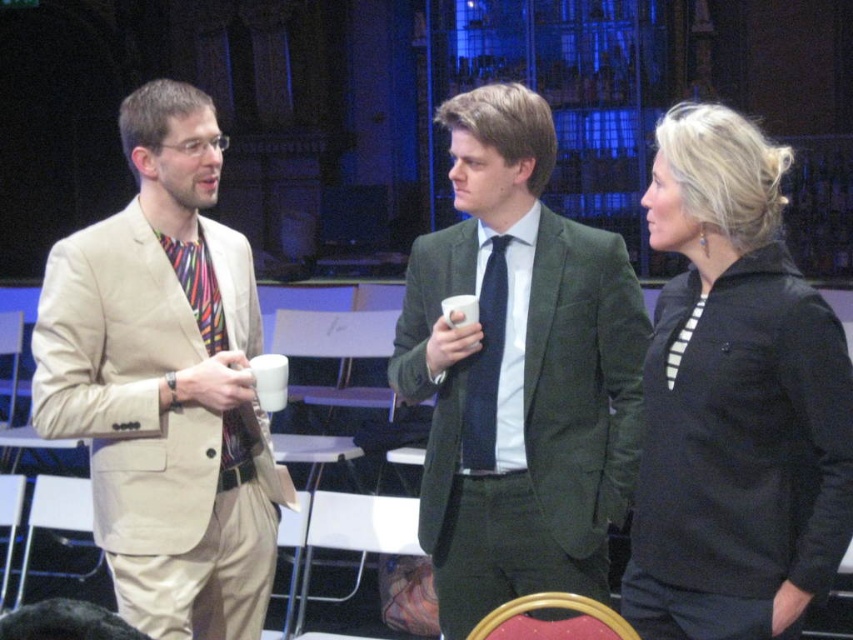
Question: Can you confirm if beige cotton suit at left is positioned below white striped tie at center?

Choices:
 (A) yes
 (B) no

Answer: (A)

Question: Which of the following is the farthest from the observer?

Choices:
 (A) (428, 248)
 (B) (227, 330)
 (C) (474, 387)
 (D) (695, 317)

Answer: (A)

Question: Which object appears closest to the camera in this image?

Choices:
 (A) beige cotton suit at left
 (B) multicolored fabric tie at left

Answer: (A)

Question: Can you confirm if black matte jacket at center is thinner than dark blue textured tie at center?

Choices:
 (A) yes
 (B) no

Answer: (B)

Question: Which object is the closest to the green velvet suit at center?

Choices:
 (A) black matte jacket at center
 (B) beige cotton suit at left

Answer: (A)

Question: Is beige cotton suit at left positioned behind black matte jacket at center?

Choices:
 (A) no
 (B) yes

Answer: (B)